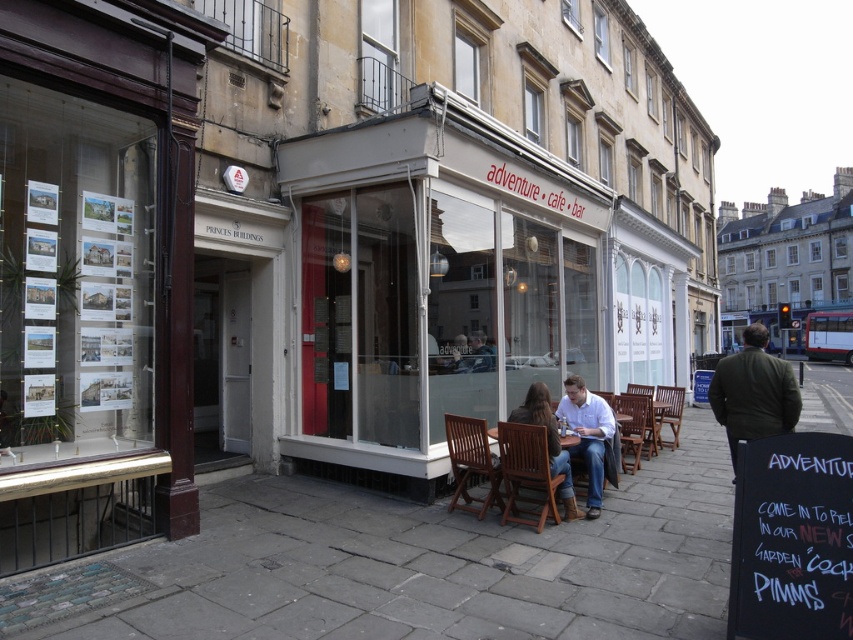
Question: From the image, what is the correct spatial relationship of black chalkboard at lower right in relation to dark green jacket at center?

Choices:
 (A) above
 (B) below

Answer: (A)

Question: Which point is closer to the camera?

Choices:
 (A) dark green jacket at center
 (B) black chalkboard at lower right
 (C) wooden chairs at center

Answer: (B)

Question: Can you confirm if black chalkboard at lower right is thinner than wooden chairs at center?

Choices:
 (A) no
 (B) yes

Answer: (B)

Question: Which point is farther to the camera?

Choices:
 (A) wooden chairs at center
 (B) black chalkboard at lower right
 (C) dark green jacket at center

Answer: (A)

Question: Which of the following is the closest to the observer?

Choices:
 (A) (573, 378)
 (B) (761, 410)

Answer: (B)

Question: Does black chalkboard at lower right have a smaller size compared to dark green jacket at center?

Choices:
 (A) no
 (B) yes

Answer: (B)